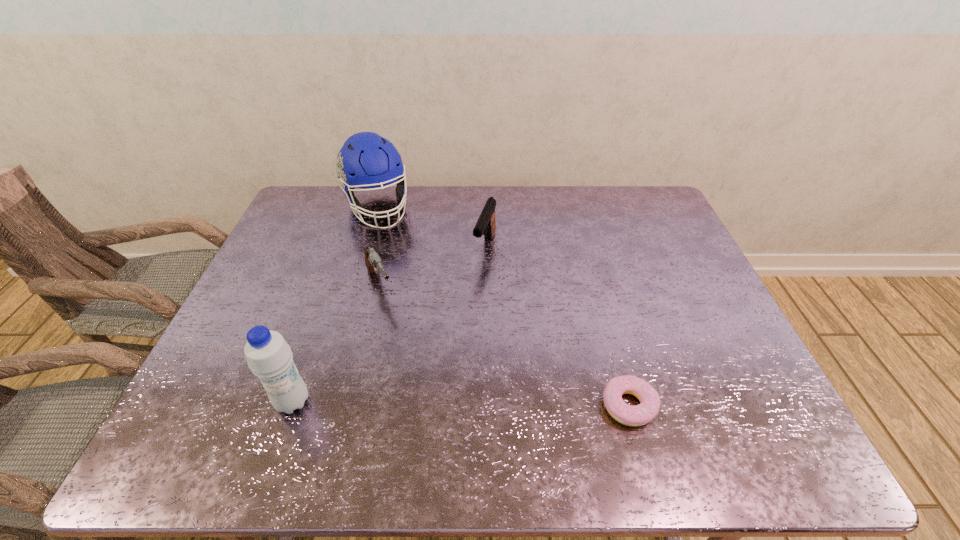
At what (x,y) coordinates should I click in order to perform the action: click on water bottle. Please return your answer as a coordinate pair (x, y). The image size is (960, 540). Looking at the image, I should click on (269, 356).

The width and height of the screenshot is (960, 540). In order to click on the rightmost object in this screenshot , I will do `click(641, 414)`.

At what (x,y) coordinates should I click in order to perform the action: click on the shortest object. Please return your answer as a coordinate pair (x, y). The width and height of the screenshot is (960, 540). Looking at the image, I should click on (641, 414).

Locate an element on the screen. The image size is (960, 540). the left pistol is located at coordinates (373, 262).

Find the location of `the shorter pistol`. the shorter pistol is located at coordinates (373, 262).

The image size is (960, 540). In order to click on the taller pistol in this screenshot , I will do `click(486, 225)`.

The height and width of the screenshot is (540, 960). Find the location of `the fourth object from left to right`. the fourth object from left to right is located at coordinates (486, 225).

The width and height of the screenshot is (960, 540). Find the location of `football helmet`. football helmet is located at coordinates (366, 160).

Where is `free space located on the back of the water bottle`? Image resolution: width=960 pixels, height=540 pixels. free space located on the back of the water bottle is located at coordinates (313, 344).

What are the coordinates of `free location located 0.370m on the back of the rightmost object` in the screenshot? It's located at (592, 273).